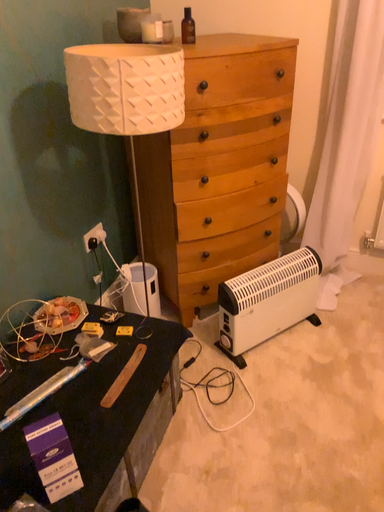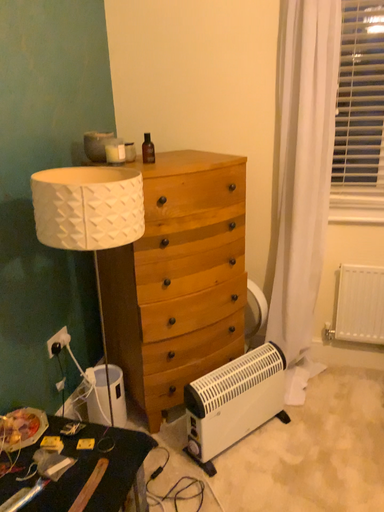
Question: Which way did the camera rotate in the video?

Choices:
 (A) rotated upward
 (B) rotated downward

Answer: (A)